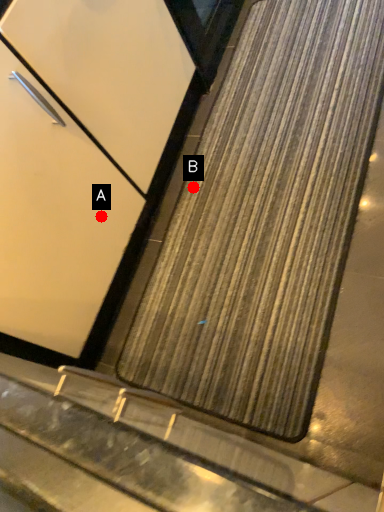
Question: Two points are circled on the image, labeled by A and B beside each circle. Among these points, which one is farthest from the camera?

Choices:
 (A) A is further
 (B) B is further

Answer: (B)